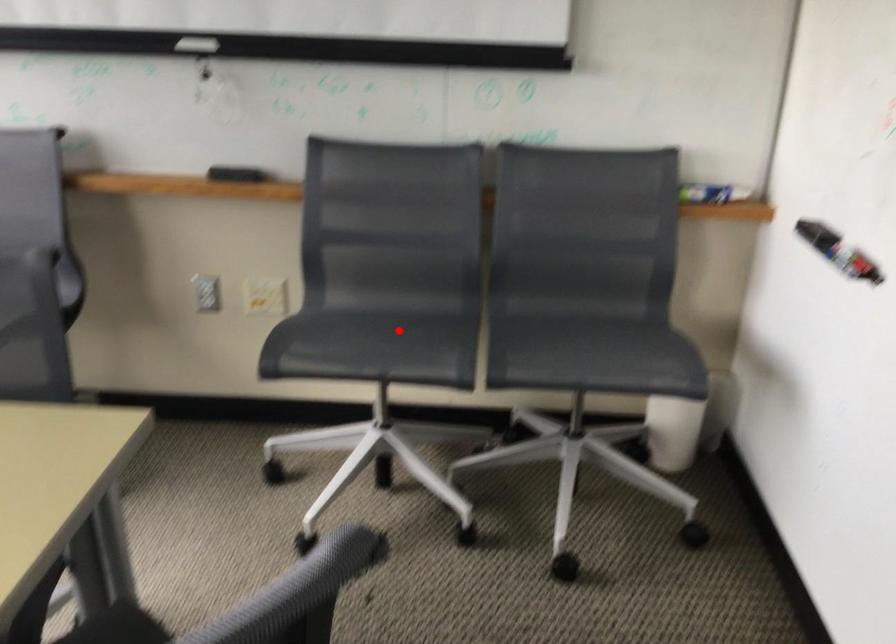
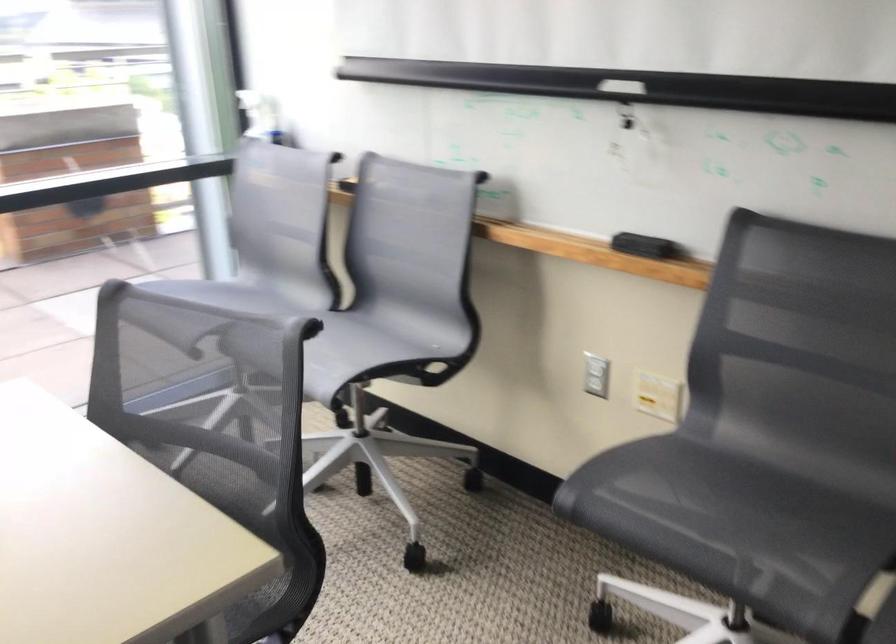
Question: I am providing you with two images of the same scene from different viewpoints. A red point is marked on the first image. Is the red point's position out of view in image 2?

Choices:
 (A) Yes
 (B) No

Answer: (B)